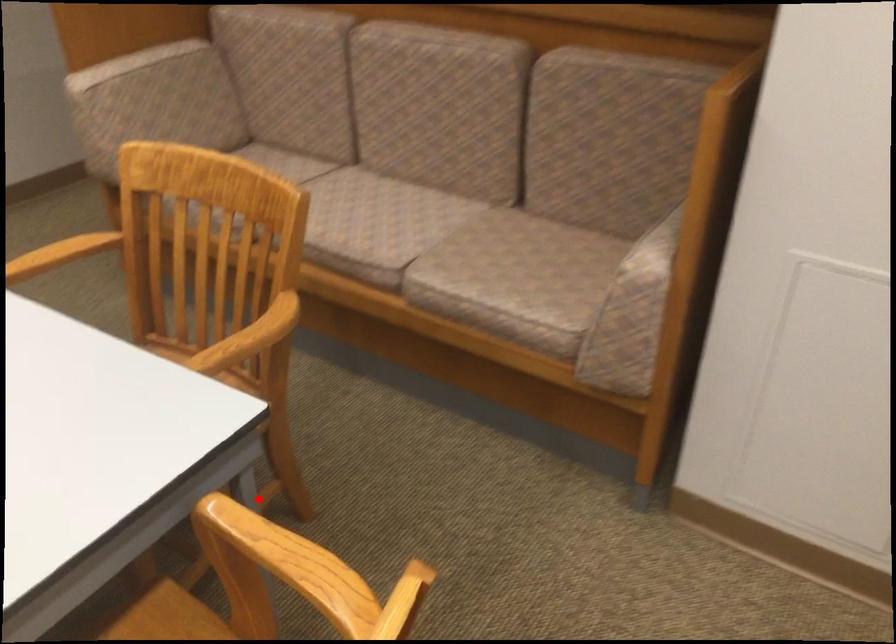
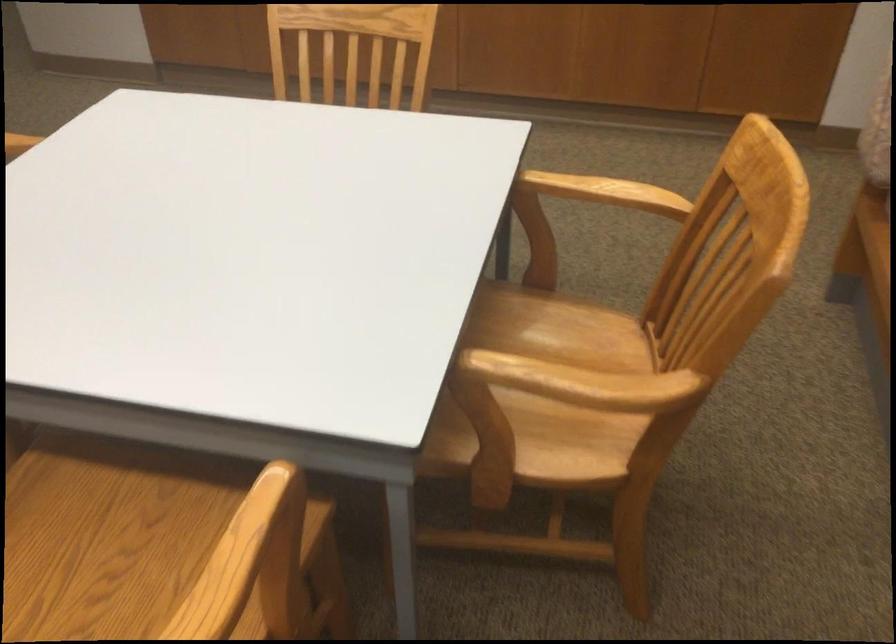
Question: I am providing you with two images of the same scene from different viewpoints. A red point is marked on the first image. Can you still see the location of the red point in image 2?

Choices:
 (A) Yes
 (B) No

Answer: (B)